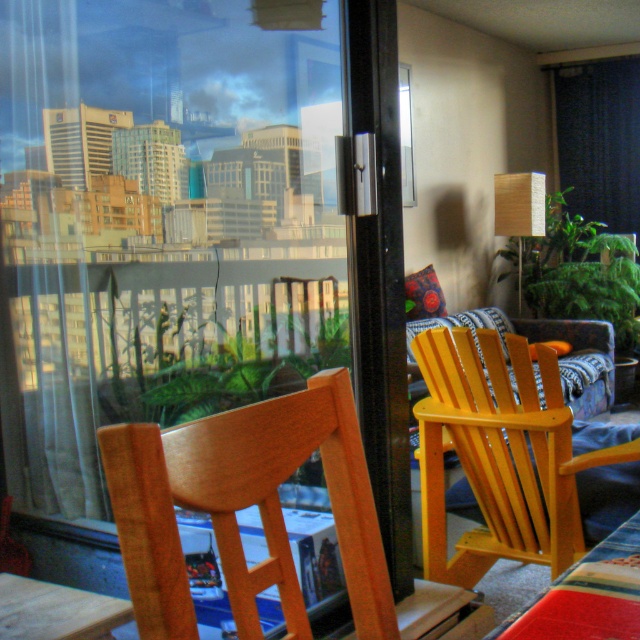
Does point (444, 561) come closer to viewer compared to point (38, 614)?

No.

The image size is (640, 640). In order to click on yellow wood chair at right in this screenshot , I will do `click(499, 456)`.

Locate an element on the screen. The width and height of the screenshot is (640, 640). yellow wood chair at right is located at coordinates click(499, 456).

Who is taller, transparent glass door at upper center or wooden table at lower right?

transparent glass door at upper center is taller.

Is transparent glass door at upper center shorter than wooden table at lower right?

Incorrect, transparent glass door at upper center's height does not fall short of wooden table at lower right's.

At what (x,y) coordinates should I click in order to perform the action: click on transparent glass door at upper center. Please return your answer as a coordinate pair (x, y). Looking at the image, I should click on (193, 227).

Between point (544, 630) and point (109, 620), which one is positioned in front?

Point (544, 630) is in front.

Who is higher up, wooden table at lower right or wooden table at lower left?

wooden table at lower right is higher up.

Image resolution: width=640 pixels, height=640 pixels. Identify the location of wooden table at lower right. (588, 595).

Locate an element on the screen. This screenshot has height=640, width=640. wooden table at lower right is located at coordinates (588, 595).